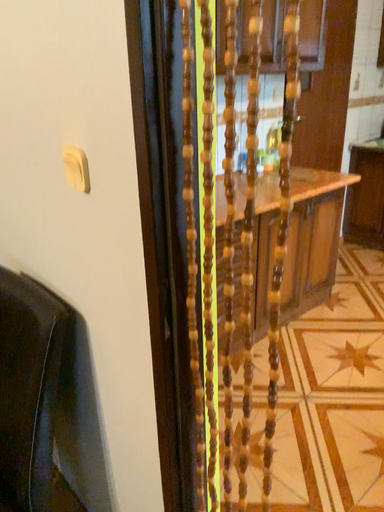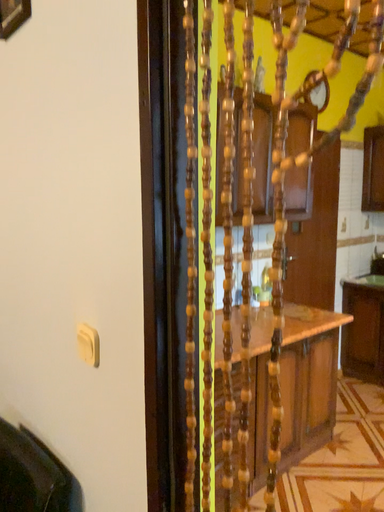
Question: Which way did the camera rotate in the video?

Choices:
 (A) rotated upward
 (B) rotated downward

Answer: (A)